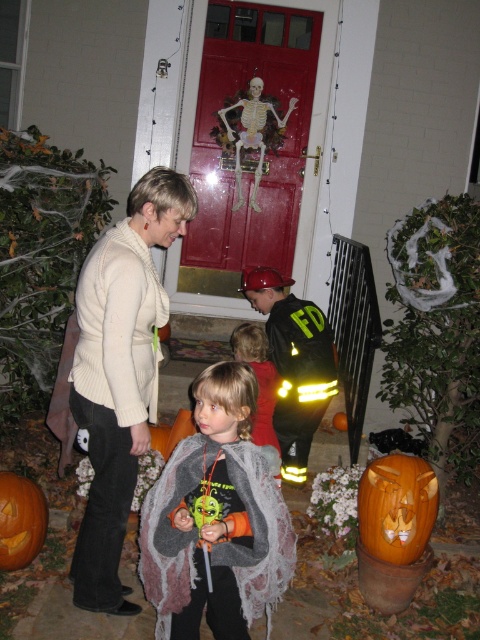
You are a costume designer trying to arrange two capes for a Halloween display. The fuzzy gray cape at center and the gray wool cape at center need to be placed on a mannequin. The display requires the capes to be at least 1.5 meters apart. Can you place them according to the requirements?

The fuzzy gray cape at center is 1.28 meters from gray wool cape at center, which is less than the required 1.5 meters. Therefore, they cannot be placed according to the display requirements.

You are a costume designer looking at the Halloween scene. You see the fuzzy gray cape at center and the gray wool cape at center. Which cape is wider?

The fuzzy gray cape at center is wider than the gray wool cape at center.

Based on the photo, you are standing at the center of the scene. The orange carved pumpkin at lower right is at point 0.794, 0.827. If you want to walk directly towards it, which direction should you move? Please provide your answer as a coordinate direction in terms of the scene coordinate system where the origin is at the bottom left corner of the image.

To move towards the orange carved pumpkin at lower right located at coordinate point (x=396, y=508), you should move in the direction of increasing x and y coordinates since the pumpkin is positioned at a higher x and y value compared to the center point.